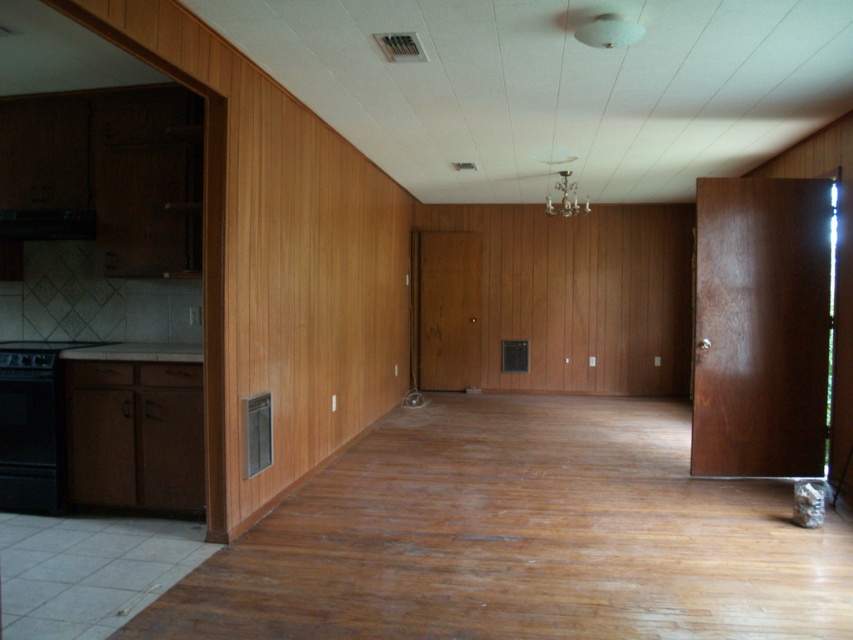
Does black matte oven at left lie in front of black matte exhaust hood at left?

That is True.

Does black matte oven at left have a greater height compared to black matte exhaust hood at left?

Indeed, black matte oven at left has a greater height compared to black matte exhaust hood at left.

Where is `black matte oven at left`? This screenshot has width=853, height=640. black matte oven at left is located at coordinates (30, 429).